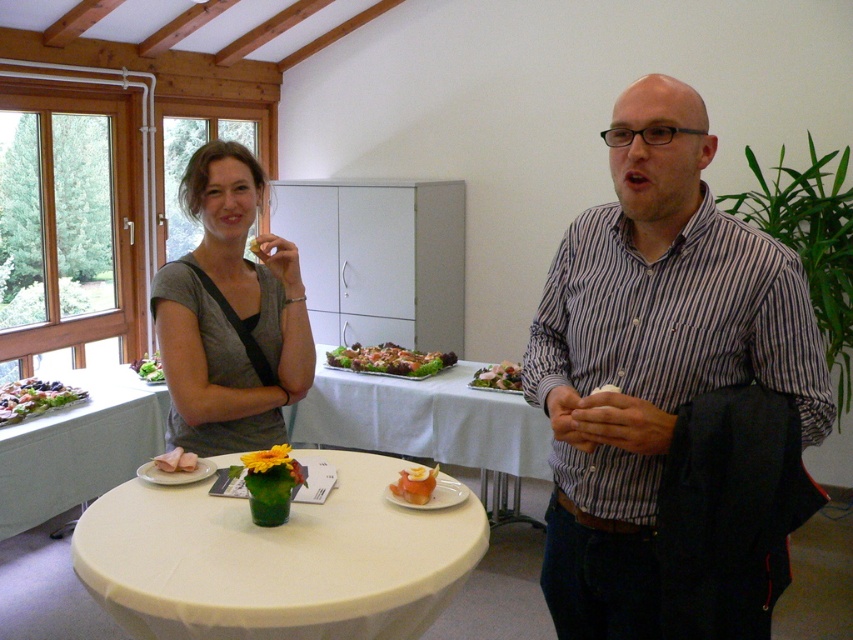
Question: Which point is farther to the camera?

Choices:
 (A) (180, 458)
 (B) (280, 387)
 (C) (508, 362)
 (D) (438, 352)

Answer: (D)

Question: Among these points, which one is nearest to the camera?

Choices:
 (A) (225, 435)
 (B) (721, 276)
 (C) (407, 490)

Answer: (B)

Question: Does gray matte shirt at left appear over green leafy salad at left?

Choices:
 (A) no
 (B) yes

Answer: (B)

Question: Is green leafy salad at center positioned behind smooth white plate at center?

Choices:
 (A) no
 (B) yes

Answer: (B)

Question: Is white glossy plate at center bigger than green leafy salad at center?

Choices:
 (A) yes
 (B) no

Answer: (A)

Question: Which of these objects is positioned farthest from the white cloth-covered table at center?

Choices:
 (A) green leafy salad at left
 (B) blueberry-covered cake at left

Answer: (A)